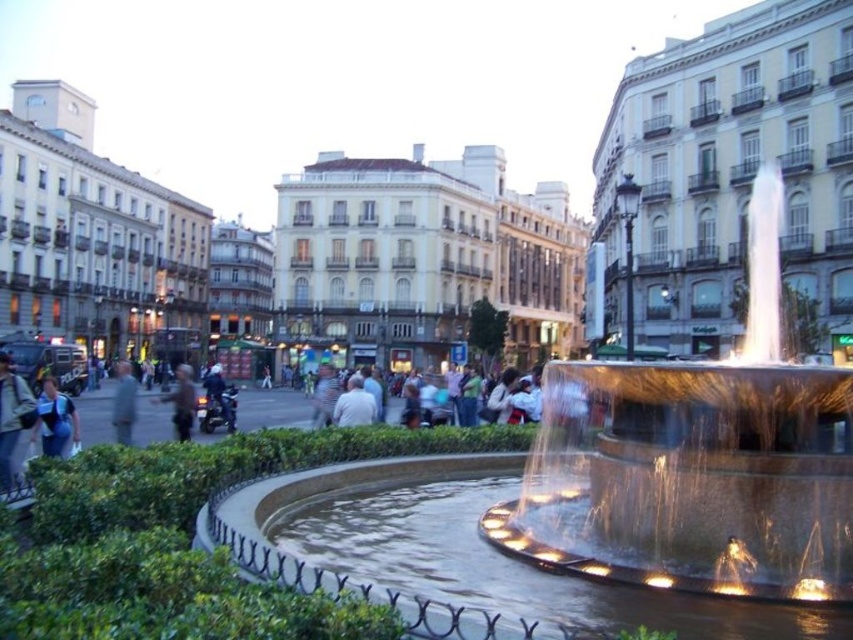
Question: Which of the following is the farthest from the observer?

Choices:
 (A) blue denim jacket at lower left
 (B) light blue denim jacket at center
 (C) illuminated stone fountain at center

Answer: (A)

Question: Which of the following is the farthest from the observer?

Choices:
 (A) (149, 440)
 (B) (851, 400)
 (C) (64, 435)
 (D) (119, 429)

Answer: (A)

Question: In this image, where is dark gray shirt at left located relative to light gray shirt at center?

Choices:
 (A) right
 (B) left

Answer: (B)

Question: Estimate the real-world distances between objects in this image. Which object is farther from the dark gray shirt at left?

Choices:
 (A) light blue denim jacket at center
 (B) light gray shirt at center

Answer: (B)

Question: Observing the image, what is the correct spatial positioning of illuminated stone fountain at center in reference to dark gray shirt at left?

Choices:
 (A) right
 (B) left

Answer: (A)

Question: Can you confirm if illuminated stone fountain at center is wider than dark brown leather jacket at center?

Choices:
 (A) no
 (B) yes

Answer: (B)